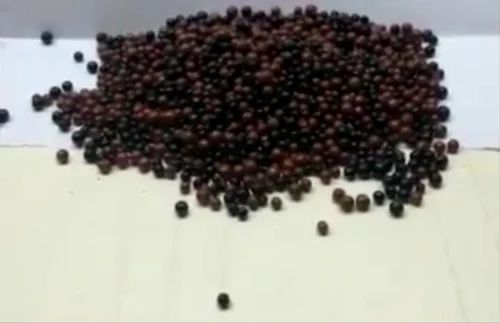
Locate an element on the screen. This screenshot has width=500, height=323. table top seen through seeds is located at coordinates (408, 151), (164, 165), (342, 166), (354, 191), (315, 179).